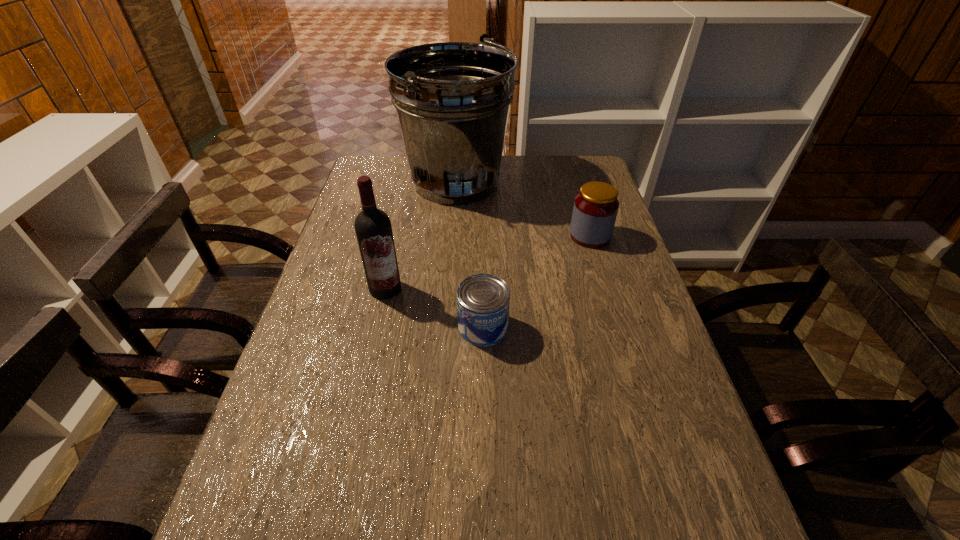
What are the coordinates of `free space located on the left of the rightmost object` in the screenshot? It's located at (510, 236).

Locate an element on the screen. vacant space located 0.140m on the front label of the shortest object is located at coordinates (484, 397).

You are a GUI agent. You are given a task and a screenshot of the screen. Output one action in this format:
    pyautogui.click(x=<x>, y=<y>)
    Task: Click on the object situated at the far edge
    Image resolution: width=960 pixels, height=540 pixels.
    Given the screenshot: What is the action you would take?
    click(452, 99)

Locate an element on the screen. The height and width of the screenshot is (540, 960). bucket that is at the left edge is located at coordinates (452, 99).

I want to click on wine bottle located at the left edge, so click(373, 228).

Identify the location of object that is at the right edge. (595, 209).

Locate an element on the screen. Image resolution: width=960 pixels, height=540 pixels. object positioned at the far left corner is located at coordinates (452, 99).

This screenshot has height=540, width=960. What are the coordinates of `blank space at the far edge of the desktop` in the screenshot? It's located at (548, 157).

Locate an element on the screen. The image size is (960, 540). vacant area at the left edge is located at coordinates (310, 339).

This screenshot has height=540, width=960. Find the location of `free space at the right edge of the desktop`. free space at the right edge of the desktop is located at coordinates (674, 491).